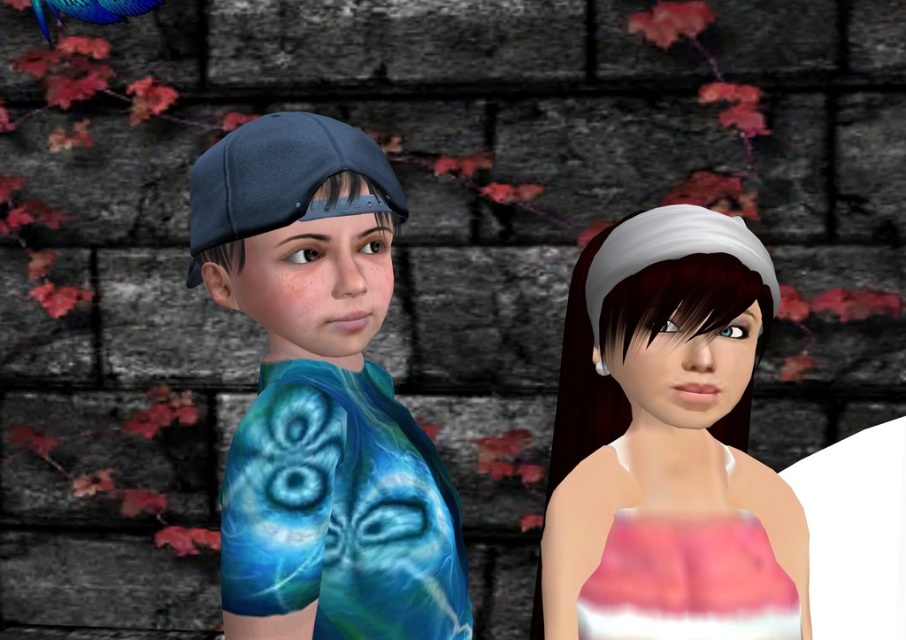
Question: Is blue tie-dye shirt at left further to camera compared to white matte hairband at upper right?

Choices:
 (A) no
 (B) yes

Answer: (A)

Question: Which object is positioned closest to the blue tie-dye shirt at left?

Choices:
 (A) matte blue baseball cap at left
 (B) white matte hairband at upper right

Answer: (A)

Question: Which of these objects is positioned closest to the white matte hairband at upper right?

Choices:
 (A) matte blue baseball cap at left
 (B) blue tie-dye shirt at left

Answer: (B)

Question: In this image, where is blue tie-dye shirt at left located relative to white matte hairband at upper right?

Choices:
 (A) below
 (B) above

Answer: (B)

Question: Which point is farther from the camera taking this photo?

Choices:
 (A) (712, 416)
 (B) (389, 381)

Answer: (A)

Question: Is blue tie-dye shirt at left bigger than white matte hairband at upper right?

Choices:
 (A) no
 (B) yes

Answer: (A)